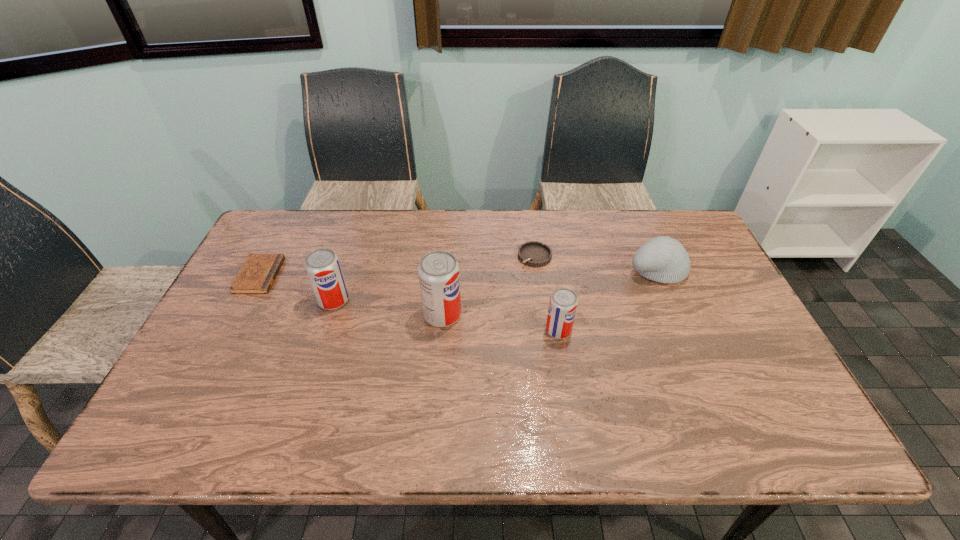
All sodas are currently evenly spaced. To continue this pattern, where would you add another soda on the right? Please point out a vacant spot. Please provide its 2D coordinates. Your answer should be formatted as a tuple, i.e. [(x, y)], where the tuple contains the x and y coordinates of a point satisfying the conditions above.

[(683, 347)]